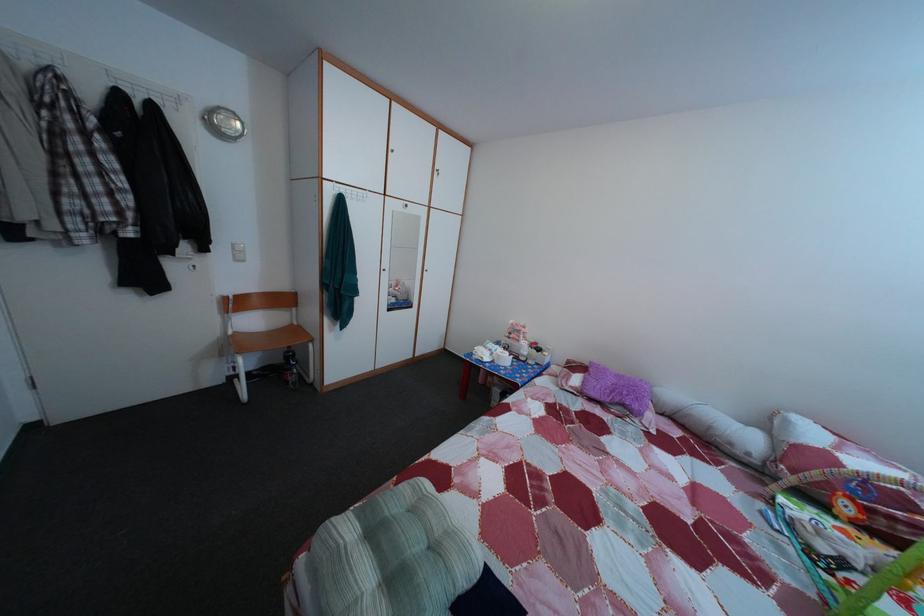
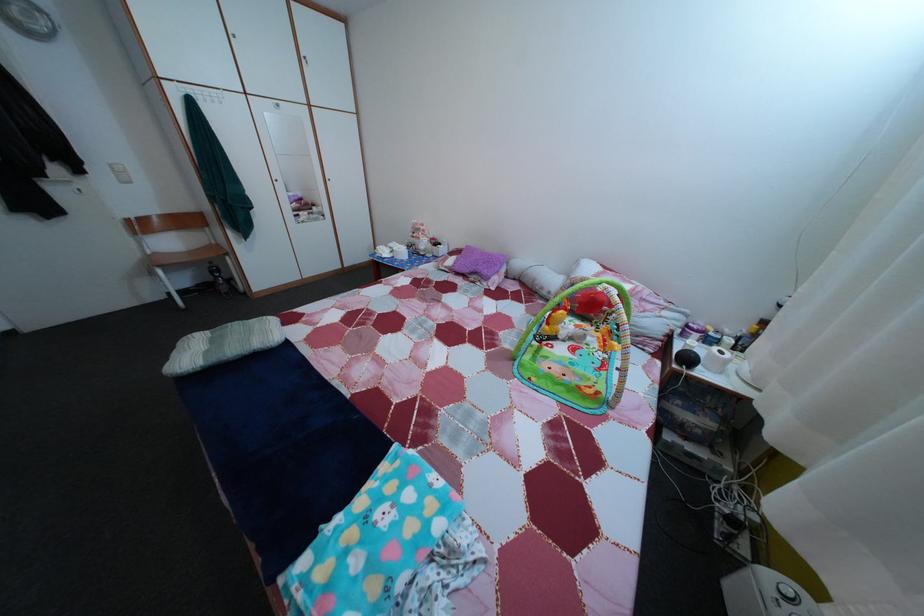
Locate, in the second image, the point that corresponds to point 748,461 in the first image.

(553, 301)